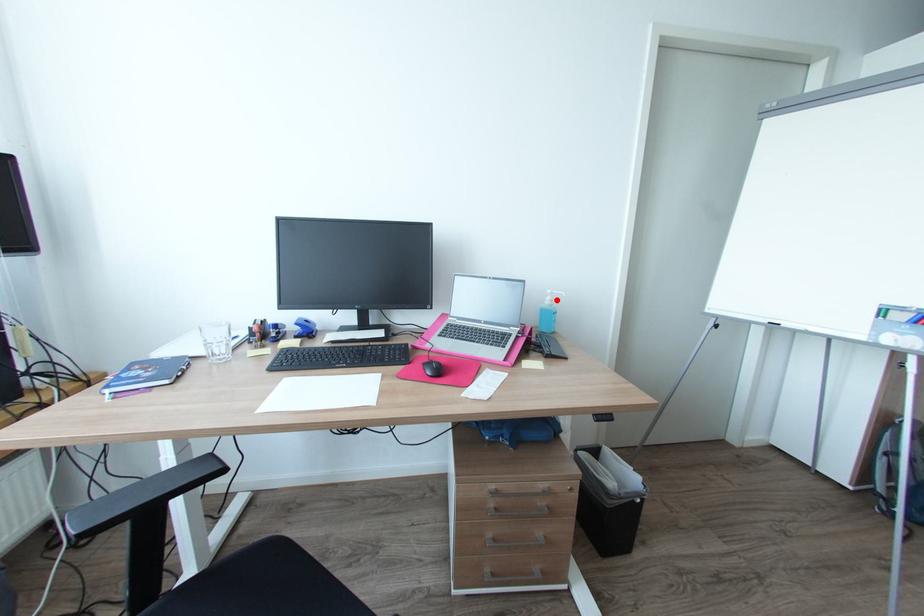
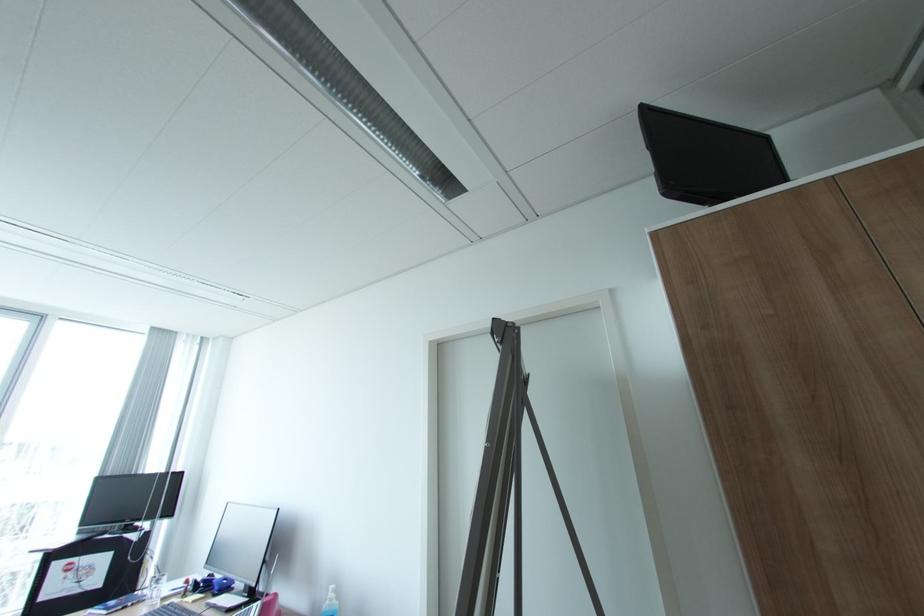
In the second image, find the point that corresponds to the highlighted location in the first image.

(336, 599)